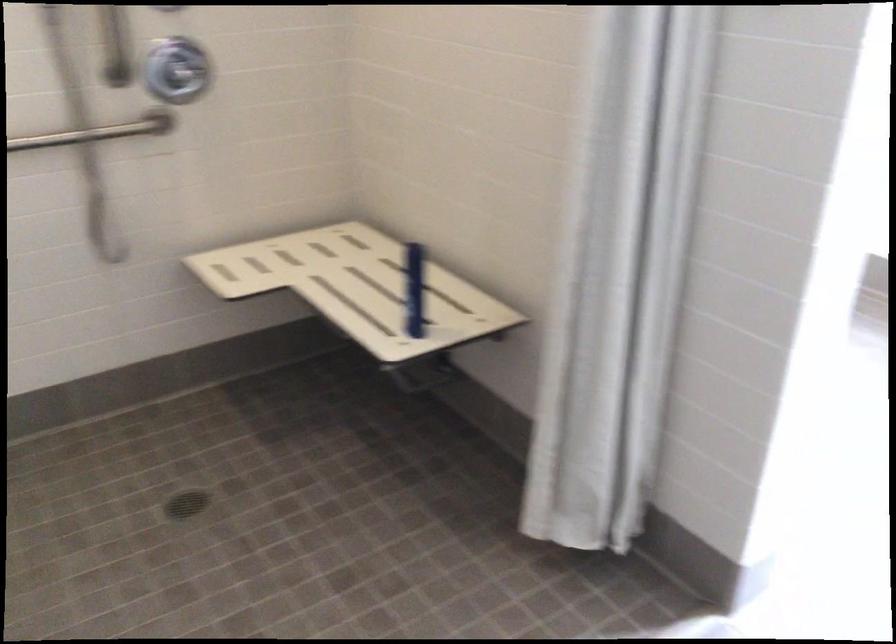
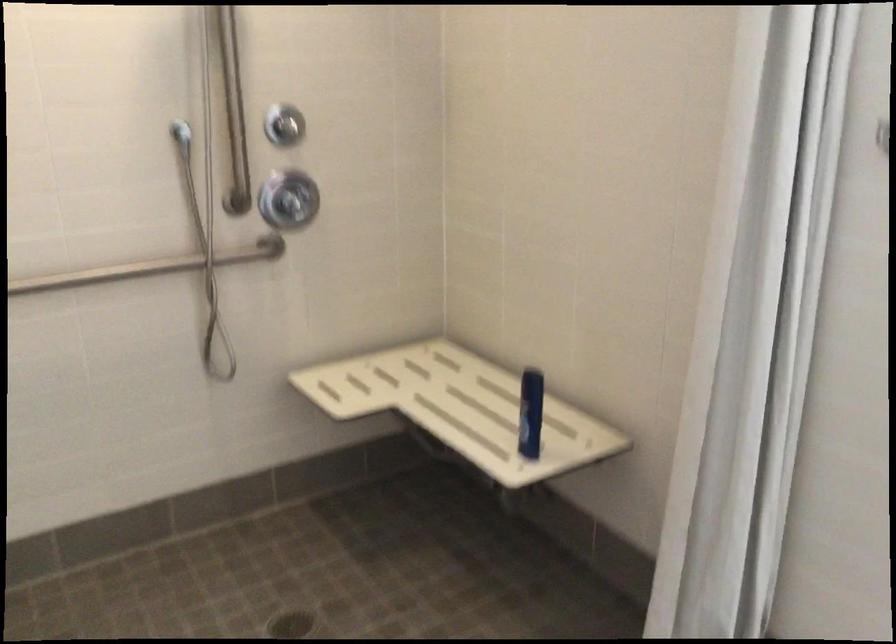
The point at (357, 288) is marked in the first image. Where is the corresponding point in the second image?

(460, 408)